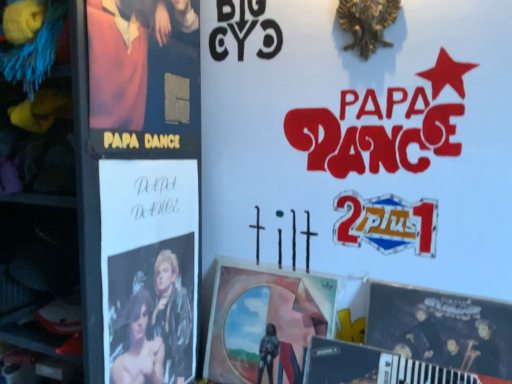
Question: Is matte pink fabric at left bigger or smaller than matte black poster at lower right, which ranks as the first poster in right-to-left order?

Choices:
 (A) big
 (B) small

Answer: (B)

Question: Choose the correct answer: Is matte pink fabric at left inside matte black poster at lower right, which ranks as the first poster in right-to-left order, or outside it?

Choices:
 (A) outside
 (B) inside

Answer: (A)

Question: Estimate the real-world distances between objects in this image. Which object is farther from the matte paper poster at center, the 2th poster in the right-to-left sequence?

Choices:
 (A) metallic silver magazine at lower right
 (B) black glossy poster at left, placed as the 1th poster when sorted from left to right
 (C) matte black poster at lower right, which ranks as the first poster in right-to-left order
 (D) matte pink fabric at left

Answer: (D)

Question: Which object is positioned closest to the matte paper poster at center, the 2th poster in the right-to-left sequence?

Choices:
 (A) black glossy poster at left, arranged as the third poster when viewed from the right
 (B) matte pink fabric at left
 (C) matte black poster at lower right, which is the third poster from left to right
 (D) metallic silver magazine at lower right

Answer: (D)